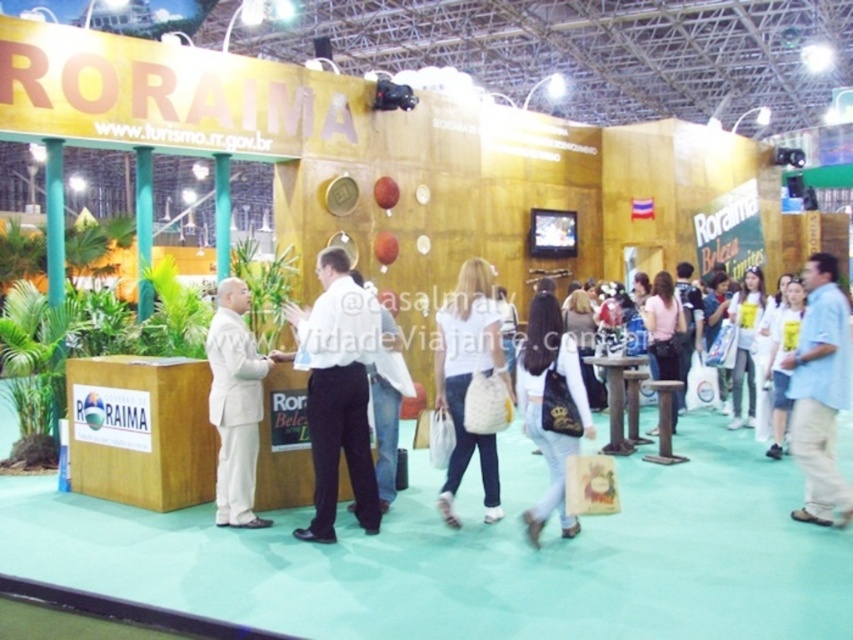
Question: Which object is farther from the camera taking this photo?

Choices:
 (A) pink fabric purse at center
 (B) white matte shirt at center
 (C) light blue shirt at right
 (D) white woven bag at center

Answer: (A)

Question: Which point is closer to the camera taking this photo?

Choices:
 (A) (465, 269)
 (B) (799, 400)
 (C) (233, 307)
 (D) (323, 493)

Answer: (D)

Question: Can you confirm if white smooth shirt at center is positioned below white woven bag at center?

Choices:
 (A) yes
 (B) no

Answer: (B)

Question: Which point is farther from the camera taking this photo?

Choices:
 (A) (354, 413)
 (B) (656, 304)
 (C) (750, 406)
 (D) (827, 419)

Answer: (C)

Question: Is pink fabric purse at center bigger than white fabric bag at lower right?

Choices:
 (A) yes
 (B) no

Answer: (A)

Question: Can you confirm if white smooth shirt at center is positioned above light blue shirt at right?

Choices:
 (A) yes
 (B) no

Answer: (A)